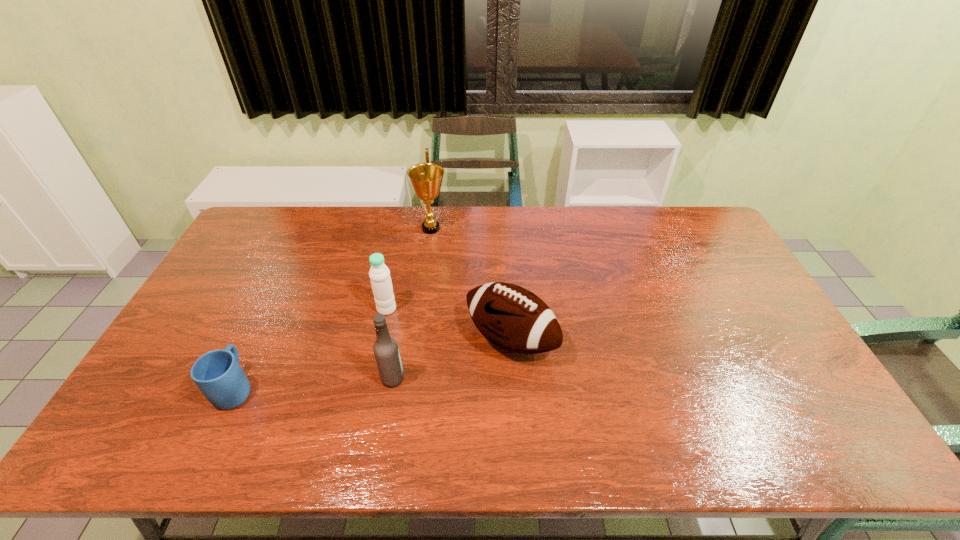
I want to click on object that ranks as the closest to the rightmost object, so click(x=386, y=351).

You are a GUI agent. You are given a task and a screenshot of the screen. Output one action in this format:
    pyautogui.click(x=<x>, y=<y>)
    Task: Click on the vacant position in the image that satisfies the following two spatial constraints: 1. on the front view with handles of the rightmost object; 2. on the left side of the award
    The width and height of the screenshot is (960, 540).
    Given the screenshot: What is the action you would take?
    pyautogui.click(x=416, y=339)

Where is `free space that satisfies the following two spatial constraints: 1. on the front view with handles of the rightmost object; 2. on the left side of the farthest object`? free space that satisfies the following two spatial constraints: 1. on the front view with handles of the rightmost object; 2. on the left side of the farthest object is located at coordinates (416, 339).

Locate an element on the screen. free space that satisfies the following two spatial constraints: 1. on the side of the water bottle with the handle; 2. on the right side of the shortest object is located at coordinates (273, 309).

Identify the location of free region that satisfies the following two spatial constraints: 1. on the front view with handles of the rightmost object; 2. on the right side of the farthest object. The image size is (960, 540). (416, 339).